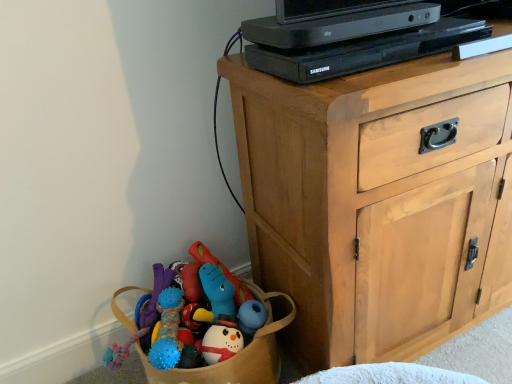
Question: Is light wood cabinet at upper right inside or outside of black plastic computer at upper center?

Choices:
 (A) outside
 (B) inside

Answer: (A)

Question: Considering the positions of light wood cabinet at upper right and black plastic computer at upper center in the image, is light wood cabinet at upper right wider or thinner than black plastic computer at upper center?

Choices:
 (A) wide
 (B) thin

Answer: (A)

Question: Visually, is light wood cabinet at upper right positioned to the left or to the right of black plastic computer at upper center?

Choices:
 (A) left
 (B) right

Answer: (B)

Question: In terms of height, does black plastic computer at upper center look taller or shorter compared to light wood cabinet at upper right?

Choices:
 (A) short
 (B) tall

Answer: (A)

Question: Is point (379, 49) positioned closer to the camera than point (324, 129)?

Choices:
 (A) farther
 (B) closer

Answer: (A)

Question: From a real-world perspective, is black plastic computer at upper center physically located above or below light wood cabinet at upper right?

Choices:
 (A) below
 (B) above

Answer: (B)

Question: Would you say black plastic computer at upper center is inside or outside light wood cabinet at upper right?

Choices:
 (A) outside
 (B) inside

Answer: (A)